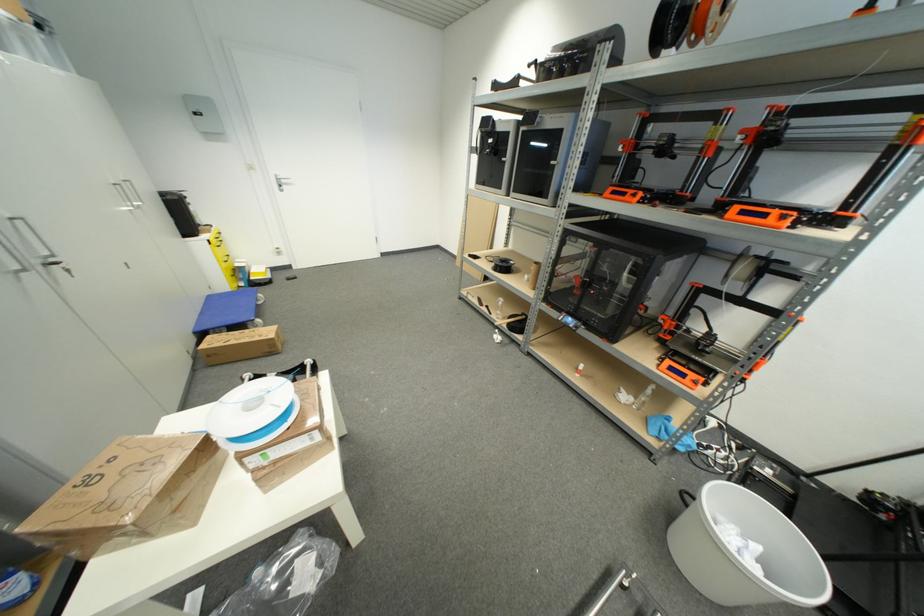
You are a GUI agent. You are given a task and a screenshot of the screen. Output one action in this format:
    pyautogui.click(x=<x>, y=<y>)
    Task: Click on the silver door handle
    
    Given the screenshot: What is the action you would take?
    pyautogui.click(x=283, y=180)